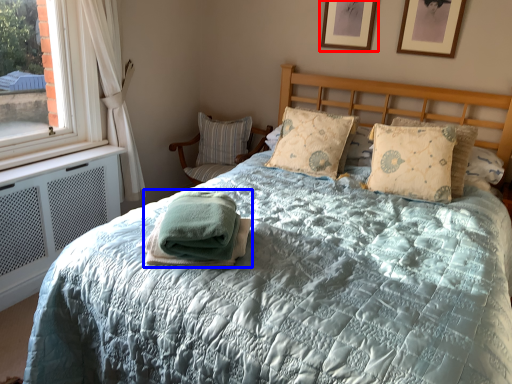
Question: Among these objects, which one is farthest to the camera, picture frame (highlighted by a red box) or blanket (highlighted by a blue box)?

Choices:
 (A) picture frame
 (B) blanket

Answer: (A)